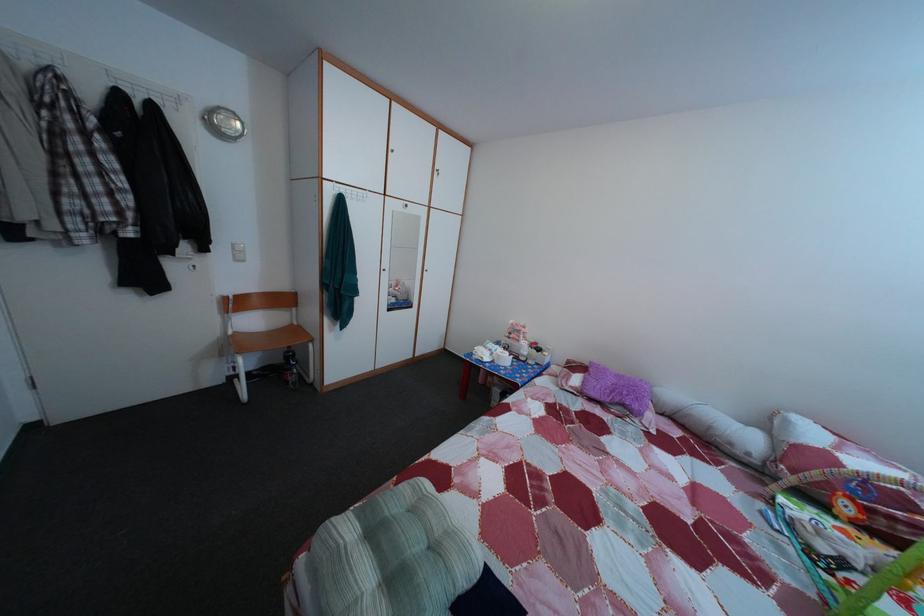
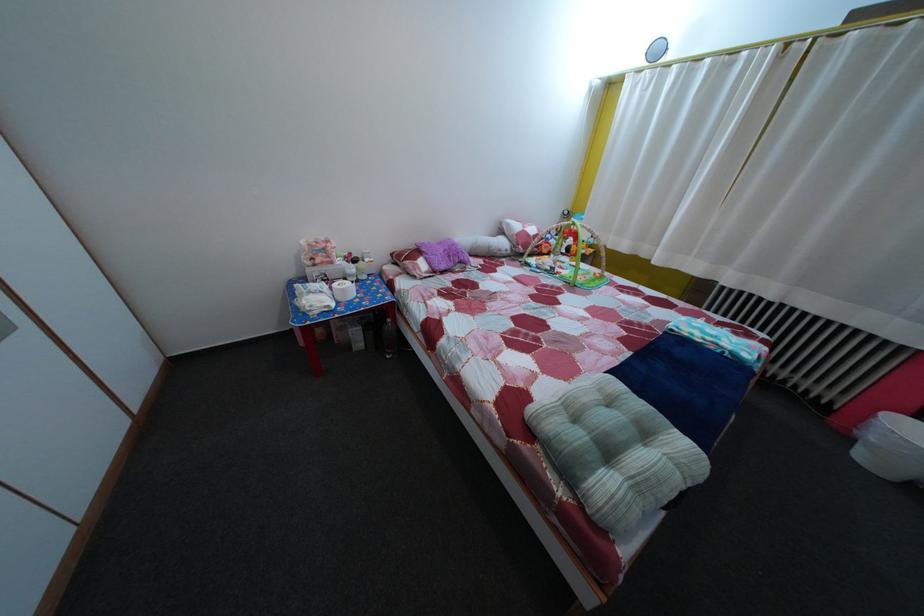
In the second image, find the point that corresponds to point 628,384 in the first image.

(450, 252)